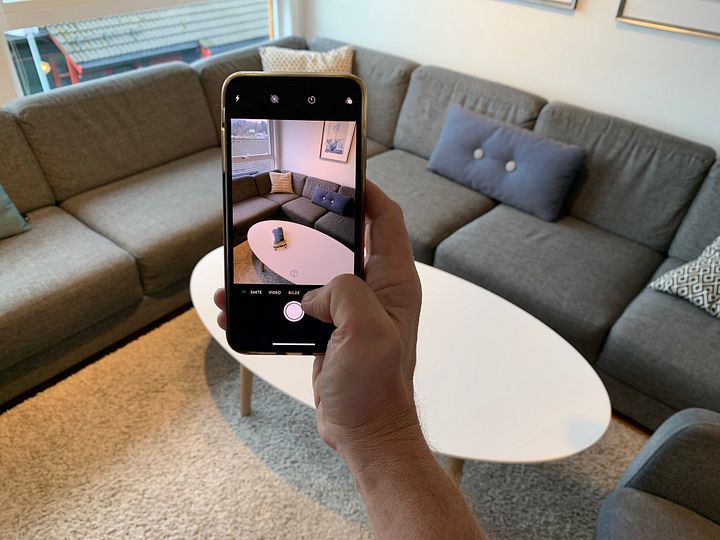
Identify the location of white and brown polkadot pillow. (284, 64).